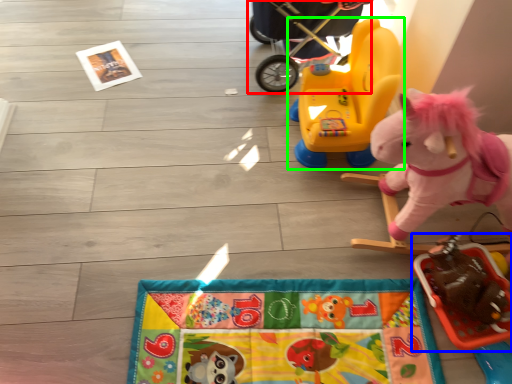
Question: Considering the real-world distances, which object is farthest from baby carriage (highlighted by a red box)? toy (highlighted by a blue box) or toy (highlighted by a green box)?

Choices:
 (A) toy
 (B) toy

Answer: (A)